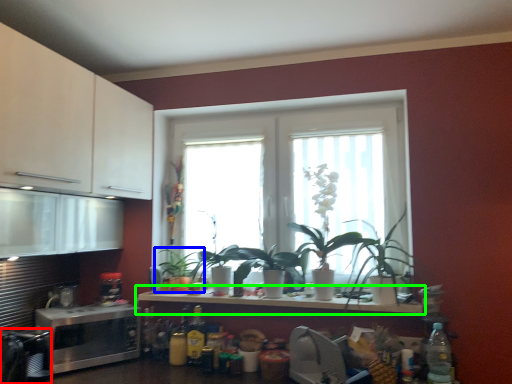
Question: Considering the real-world distances, which object is farthest from appliance (highlighted by a red box)? houseplant (highlighted by a blue box) or countertop (highlighted by a green box)?

Choices:
 (A) houseplant
 (B) countertop

Answer: (A)